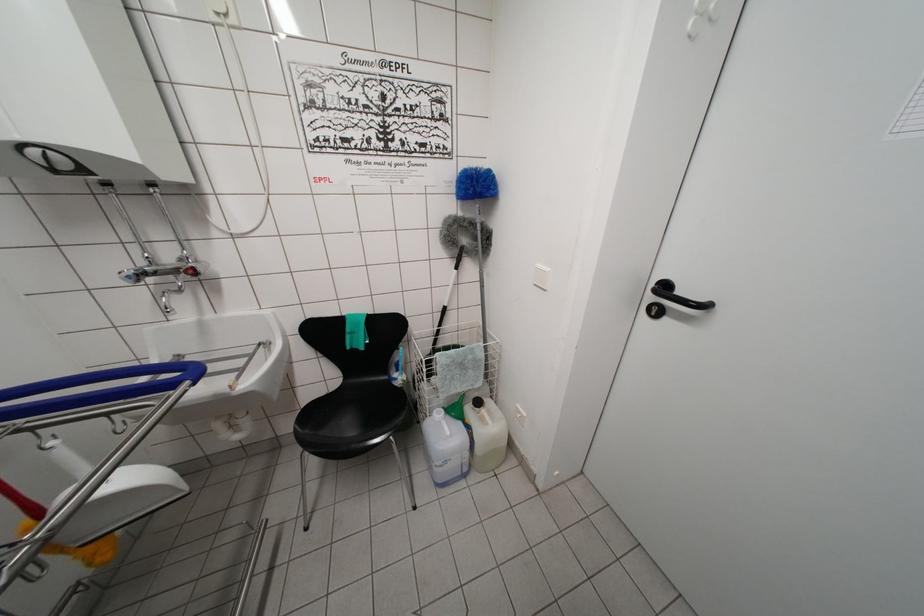
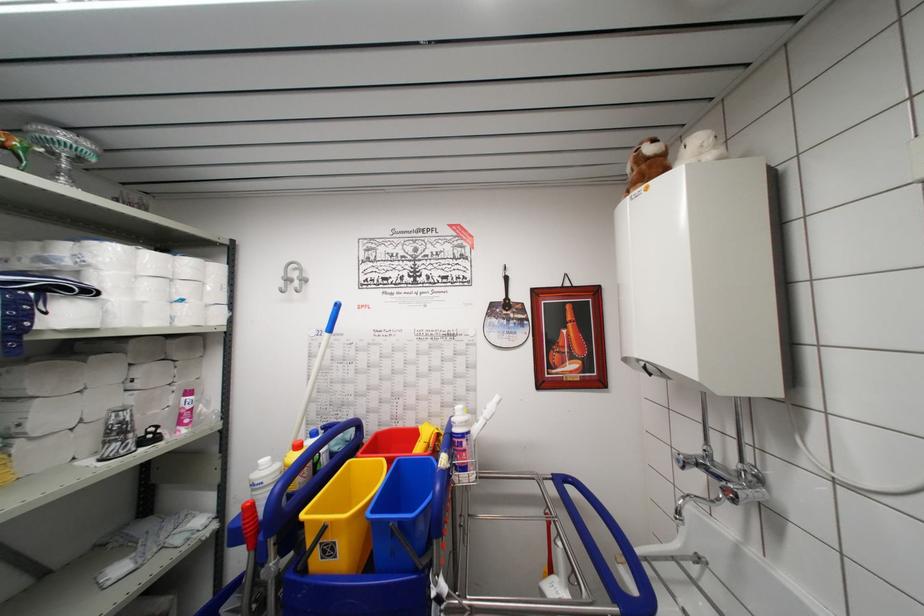
Question: The images are taken continuously from a first-person perspective. In which direction is your viewpoint rotating?

Choices:
 (A) Left
 (B) Right
 (C) Up
 (D) Down

Answer: (A)